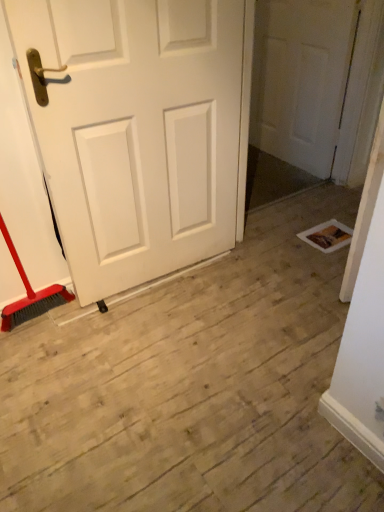
The height and width of the screenshot is (512, 384). What are the coordinates of `vacant area that is in front of white matte door at left, which appears as the 1th door when viewed from the left` in the screenshot? It's located at (158, 350).